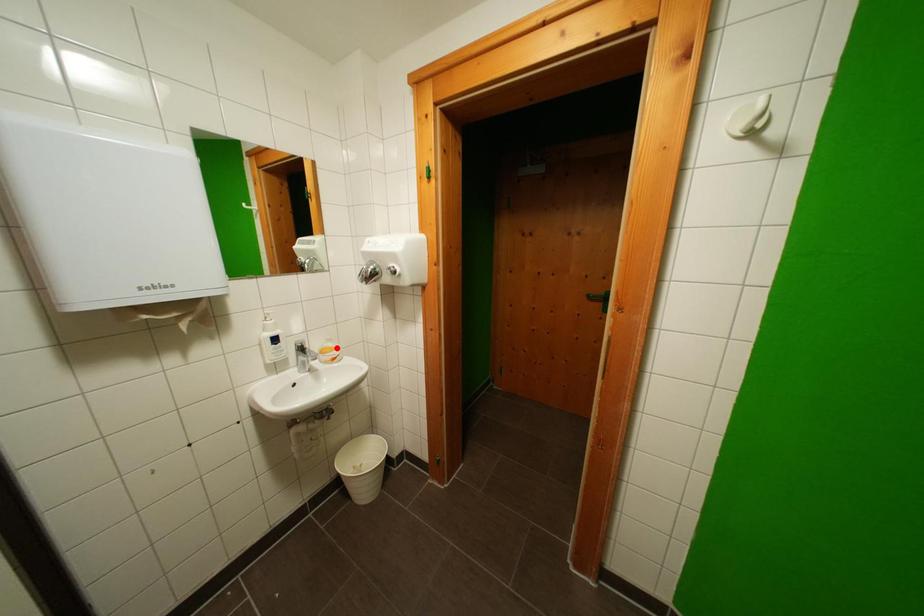
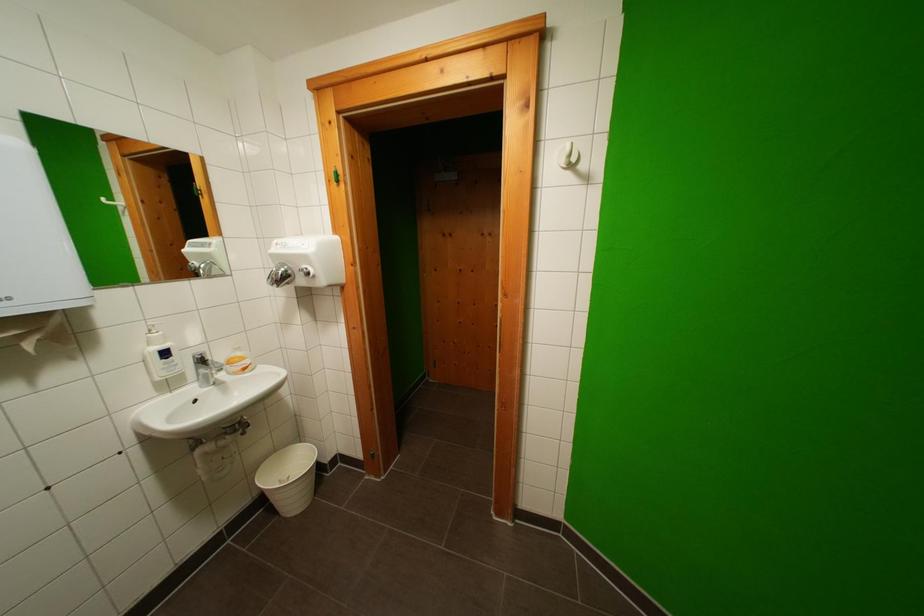
Locate, in the second image, the point that corresponds to the highlighted location in the first image.

(246, 357)